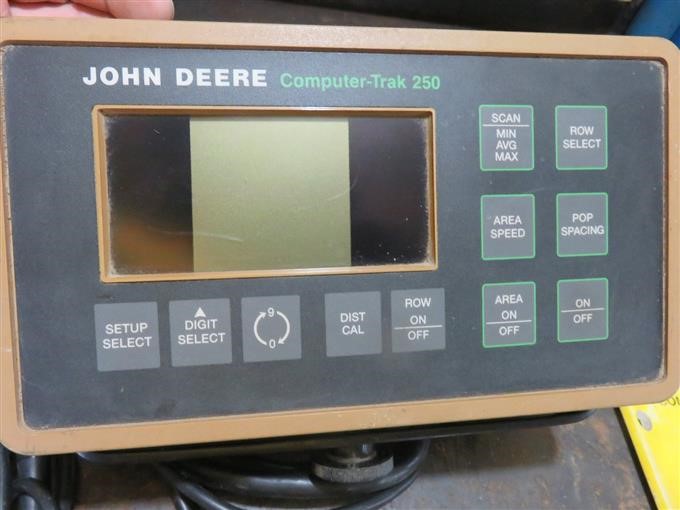
The width and height of the screenshot is (680, 510). Find the location of `black cords`. black cords is located at coordinates (197, 492), (179, 506), (37, 500).